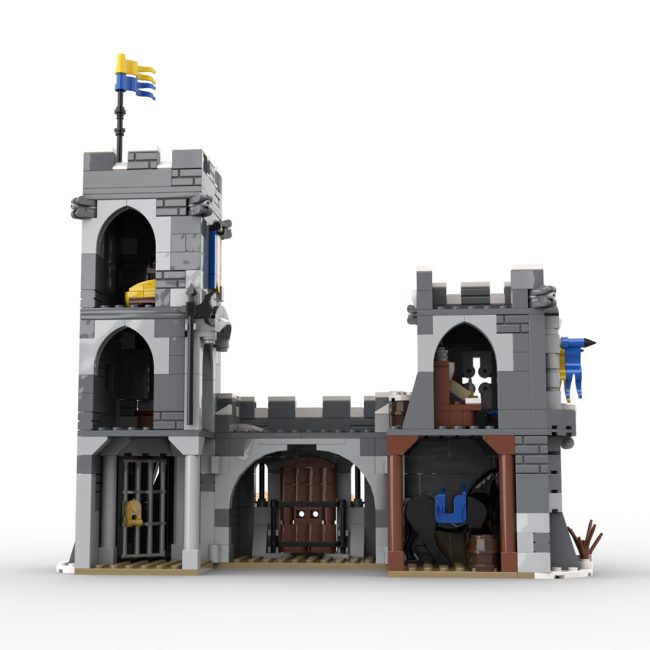
Locate an element on the screen. windows is located at coordinates (465, 377), (120, 353), (133, 257).